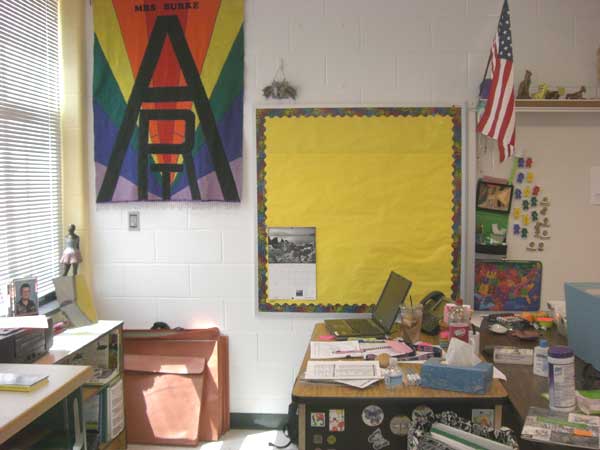
Identify the location of art poster. point(168,82).